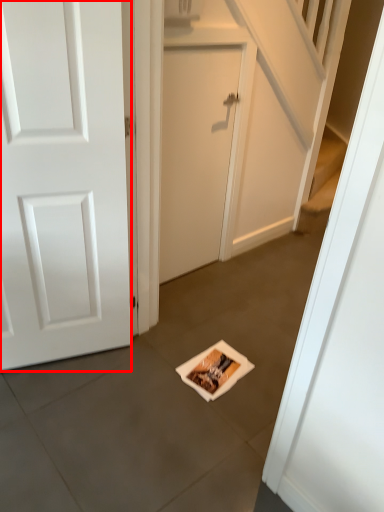
Question: Where is door (annotated by the red box) located in relation to door in the image?

Choices:
 (A) left
 (B) right

Answer: (A)